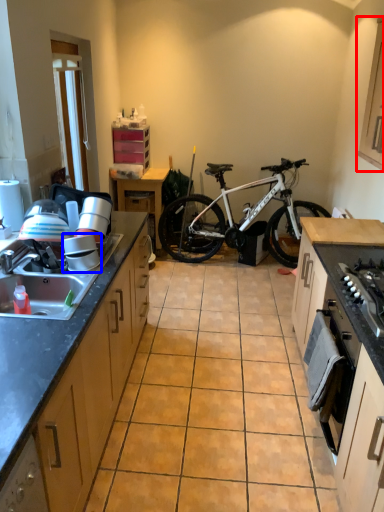
Question: Among these objects, which one is nearest to the camera, cabinetry (highlighted by a red box) or appliance (highlighted by a blue box)?

Choices:
 (A) cabinetry
 (B) appliance

Answer: (A)